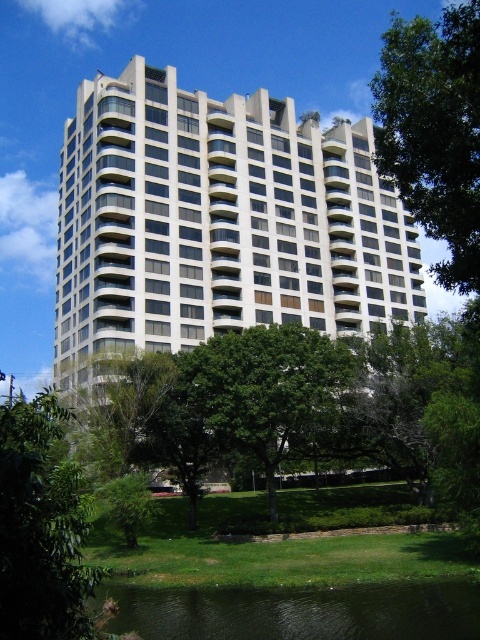
You are standing at the entrance of the residential building and want to walk to the green liquid water at lower center. Based on the coordinates provided, in which direction should you head relative to the building?

The green liquid water at lower center is located at coordinates point (300, 611). Since the coordinate system typically places the origin at the bottom left corner, the x value of 0.956 indicates it is far to the right, and the y value of 0.627 means it is above the bottom edge. Therefore, you should head towards the right side of the building to reach the green liquid water at lower center.

You are standing at the point marked as point [164,600] in the image. You want to walk to the nearest exit, which is located at the base of the building. Considering the distance between you and the building, can you estimate how far you need to walk to reach the exit?

The point [164,600] is 25.19 meters away from the viewer, so you need to walk approximately 25.19 meters to reach the exit at the base of the building.

You are standing on the lawn in front of the white glass building at center and the green leafy tree at lower left. Which object is closer to the pond at the bottom edge?

The green leafy tree at lower left is closer to the pond at the bottom edge because the white glass building at center is positioned on the right side of the green leafy tree at lower left, placing it farther away from the pond.